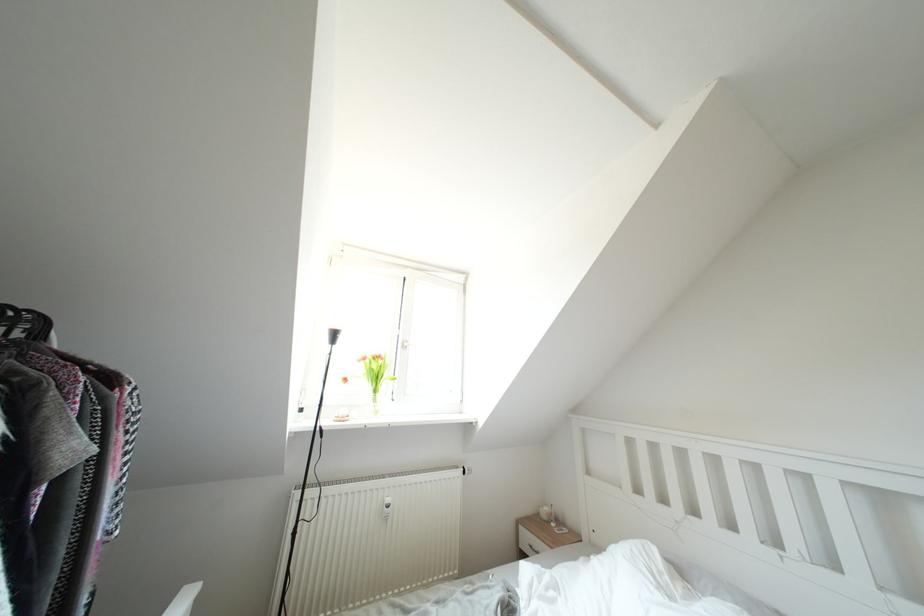
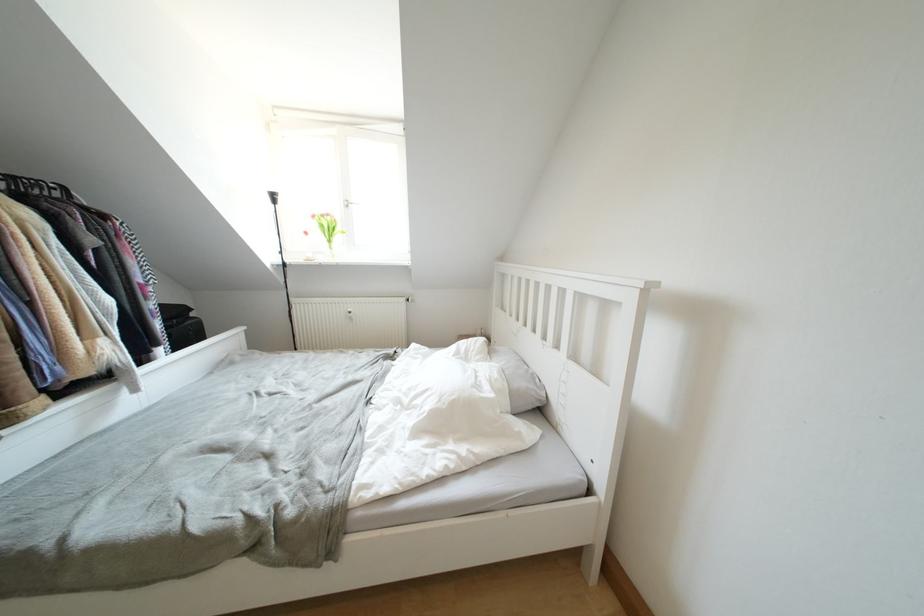
The point at (x=370, y=363) is marked in the first image. Where is the corresponding point in the second image?

(319, 220)